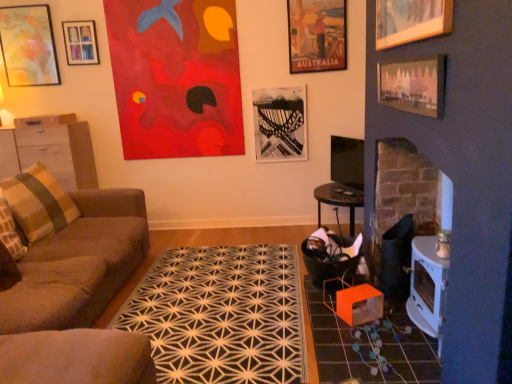
Question: Is wooden picture frame at upper right, the 1th picture frame positioned from the front, outside of wooden drawer at left?

Choices:
 (A) yes
 (B) no

Answer: (A)

Question: Are wooden picture frame at upper right, which ranks as the 6th picture frame in back-to-front order, and wooden drawer at left located far from each other?

Choices:
 (A) yes
 (B) no

Answer: (A)

Question: Is wooden picture frame at upper right, which ranks as the 6th picture frame in back-to-front order, next to wooden drawer at left and touching it?

Choices:
 (A) yes
 (B) no

Answer: (B)

Question: Is wooden drawer at left located within wooden picture frame at upper right, which ranks as the 6th picture frame in back-to-front order?

Choices:
 (A) yes
 (B) no

Answer: (B)

Question: Does wooden picture frame at upper right, which ranks as the 6th picture frame in back-to-front order, have a lesser height compared to wooden drawer at left?

Choices:
 (A) no
 (B) yes

Answer: (A)

Question: Is wooden picture frame at upper right, the 1th picture frame positioned from the front, oriented towards wooden drawer at left?

Choices:
 (A) no
 (B) yes

Answer: (B)

Question: Can you confirm if black geometric rug at center is wider than black and white photograph at center, the sixth picture frame in the front-to-back sequence?

Choices:
 (A) no
 (B) yes

Answer: (B)

Question: Is black geometric rug at center to the right of black and white photograph at center, the third picture frame when ordered from left to right, from the viewer's perspective?

Choices:
 (A) yes
 (B) no

Answer: (B)

Question: Does black geometric rug at center come behind black and white photograph at center, the third picture frame when ordered from left to right?

Choices:
 (A) yes
 (B) no

Answer: (B)

Question: From the image's perspective, is black geometric rug at center beneath black and white photograph at center, which is the 1th picture frame in back-to-front order?

Choices:
 (A) yes
 (B) no

Answer: (A)

Question: From a real-world perspective, is black geometric rug at center located beneath black and white photograph at center, the fourth picture frame from the right?

Choices:
 (A) yes
 (B) no

Answer: (A)

Question: Could you tell me if black geometric rug at center is facing black and white photograph at center, the fourth picture frame from the right?

Choices:
 (A) yes
 (B) no

Answer: (B)

Question: Is pink paper picture frame at upper right, which appears as the fifth picture frame when viewed from the back, further to camera compared to brown wood cabinet at left?

Choices:
 (A) yes
 (B) no

Answer: (B)